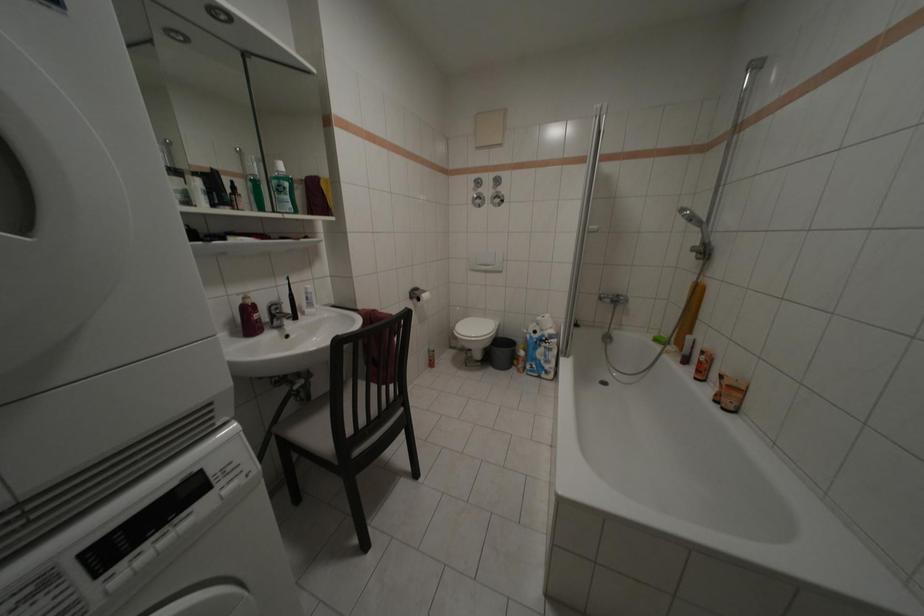
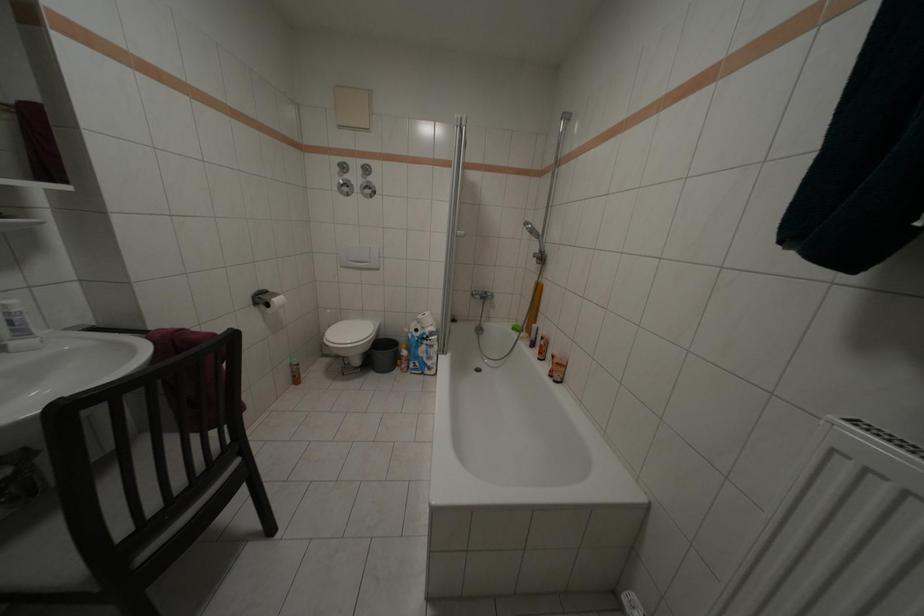
Question: The camera is either moving clockwise (left) or counter-clockwise (right) around the object. The first image is from the beginning of the video and the second image is from the end. Is the camera moving left or right when shooting the video?

Choices:
 (A) Left
 (B) Right

Answer: (A)